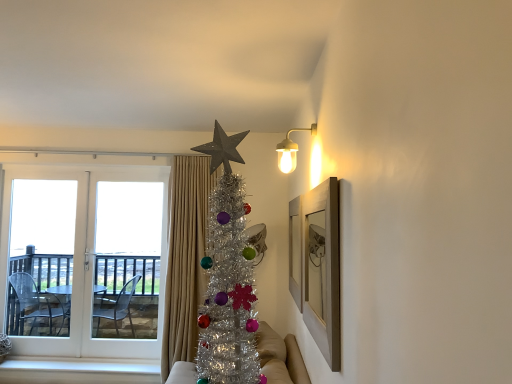
Question: Considering the positions of point (328, 294) and point (13, 301), is point (328, 294) closer or farther from the camera than point (13, 301)?

Choices:
 (A) closer
 (B) farther

Answer: (A)

Question: From their relative heights in the image, would you say wooden picture frame at upper right is taller or shorter than transparent plastic screen door at left, the 2th screen door when ordered from right to left?

Choices:
 (A) short
 (B) tall

Answer: (A)

Question: Based on their relative distances, which object is farther from the white wood at lower left?

Choices:
 (A) white glass door at left, which is the first screen door from right to left
 (B) wooden picture frame at upper right
 (C) beige fabric curtain at center
 (D) metallic fabric couch at center
 (E) transparent plastic screen door at left, the 2th screen door when ordered from right to left

Answer: (B)

Question: Estimate the real-world distances between objects in this image. Which object is closer to the transparent plastic screen door at left, placed as the first screen door when sorted from left to right?

Choices:
 (A) metallic fabric couch at center
 (B) white glass door at left
 (C) white wood at lower left
 (D) beige fabric curtain at center
 (E) wooden picture frame at upper right

Answer: (B)